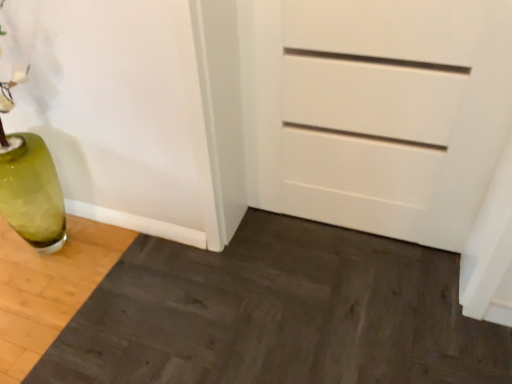
The image size is (512, 384). Describe the element at coordinates (376, 111) in the screenshot. I see `white matte chest of drawers at center` at that location.

What are the coordinates of `white matte chest of drawers at center` in the screenshot? It's located at (376, 111).

What do you see at coordinates (279, 314) in the screenshot? The image size is (512, 384). I see `dark wood doormat at lower left` at bounding box center [279, 314].

Locate an element on the screen. This screenshot has width=512, height=384. dark wood doormat at lower left is located at coordinates (279, 314).

In order to face dark wood doormat at lower left, should I rotate leftwards or rightwards?

You should look left and rotate roughly 7.631 degrees.

The height and width of the screenshot is (384, 512). What are the coordinates of `white matte chest of drawers at center` in the screenshot? It's located at (376, 111).

Can you confirm if dark wood doormat at lower left is positioned to the left of white matte chest of drawers at center?

Yes, dark wood doormat at lower left is to the left of white matte chest of drawers at center.

Consider the image. Which object is further away from the camera taking this photo, dark wood doormat at lower left or white matte chest of drawers at center?

white matte chest of drawers at center is more distant.

Is point (231, 346) farther from viewer compared to point (339, 44)?

Yes, point (231, 346) is farther from viewer.

Based on the photo, from the image's perspective, is dark wood doormat at lower left located above or below white matte chest of drawers at center?

Based on their image positions, dark wood doormat at lower left is located beneath white matte chest of drawers at center.

From a real-world perspective, which object rests below the other?

dark wood doormat at lower left.

Does dark wood doormat at lower left have a greater width compared to white matte chest of drawers at center?

Indeed, dark wood doormat at lower left has a greater width compared to white matte chest of drawers at center.

Between dark wood doormat at lower left and white matte chest of drawers at center, which one has less height?

dark wood doormat at lower left is shorter.

In terms of size, does dark wood doormat at lower left appear bigger or smaller than white matte chest of drawers at center?

Clearly, dark wood doormat at lower left is larger in size than white matte chest of drawers at center.

Would you say white matte chest of drawers at center is part of dark wood doormat at lower left's contents?

No.

Is dark wood doormat at lower left placed right next to white matte chest of drawers at center?

There is a gap between dark wood doormat at lower left and white matte chest of drawers at center.

Consider the image. Is dark wood doormat at lower left oriented away from white matte chest of drawers at center?

dark wood doormat at lower left is not turned away from white matte chest of drawers at center.

Find the location of a particular element. Image resolution: width=512 pixels, height=384 pixels. doormat below the white matte chest of drawers at center (from the image's perspective) is located at coordinates (279, 314).

Would you say white matte chest of drawers at center is to the left or to the right of dark wood doormat at lower left in the picture?

In the image, white matte chest of drawers at center appears on the right side of dark wood doormat at lower left.

Is the depth of white matte chest of drawers at center less than that of dark wood doormat at lower left?

No, white matte chest of drawers at center is further to the viewer.

Between point (496, 101) and point (245, 346), which one is positioned behind?

The point (245, 346) is farther from the camera.

From the image's perspective, would you say white matte chest of drawers at center is positioned over dark wood doormat at lower left?

Yes, from the image's perspective, white matte chest of drawers at center is on top of dark wood doormat at lower left.

From a real-world perspective, between white matte chest of drawers at center and dark wood doormat at lower left, who is vertically lower?

In real-world perspective, dark wood doormat at lower left is lower.

Considering the sizes of white matte chest of drawers at center and dark wood doormat at lower left in the image, is white matte chest of drawers at center wider or thinner than dark wood doormat at lower left?

Clearly, white matte chest of drawers at center has less width compared to dark wood doormat at lower left.

Can you confirm if white matte chest of drawers at center is shorter than dark wood doormat at lower left?

In fact, white matte chest of drawers at center may be taller than dark wood doormat at lower left.

Does white matte chest of drawers at center have a larger size compared to dark wood doormat at lower left?

Incorrect, white matte chest of drawers at center is not larger than dark wood doormat at lower left.

Can dark wood doormat at lower left be found inside white matte chest of drawers at center?

No, dark wood doormat at lower left is not a part of white matte chest of drawers at center.

Is white matte chest of drawers at center far from dark wood doormat at lower left?

Actually, white matte chest of drawers at center and dark wood doormat at lower left are a little close together.

Is white matte chest of drawers at center positioned with its back to dark wood doormat at lower left?

No, white matte chest of drawers at center is not facing away from dark wood doormat at lower left.

How far apart are white matte chest of drawers at center and dark wood doormat at lower left?

21.87 inches.

This screenshot has height=384, width=512. In order to click on chest of drawers to the right of dark wood doormat at lower left in this screenshot , I will do `click(376, 111)`.

You are a GUI agent. You are given a task and a screenshot of the screen. Output one action in this format:
    pyautogui.click(x=<x>, y=<y>)
    Task: Click on the chest of drawers behind the dark wood doormat at lower left
    This screenshot has width=512, height=384.
    Given the screenshot: What is the action you would take?
    pyautogui.click(x=376, y=111)

The image size is (512, 384). Find the location of `doormat that is under the white matte chest of drawers at center (from a real-world perspective)`. doormat that is under the white matte chest of drawers at center (from a real-world perspective) is located at coordinates (279, 314).